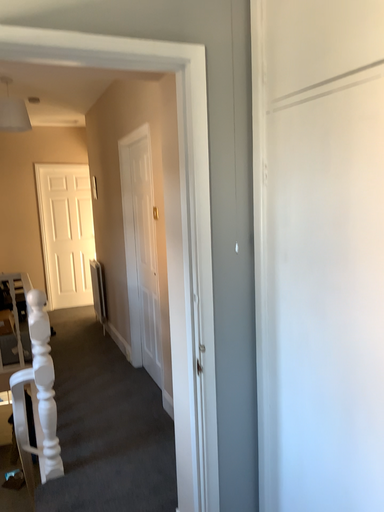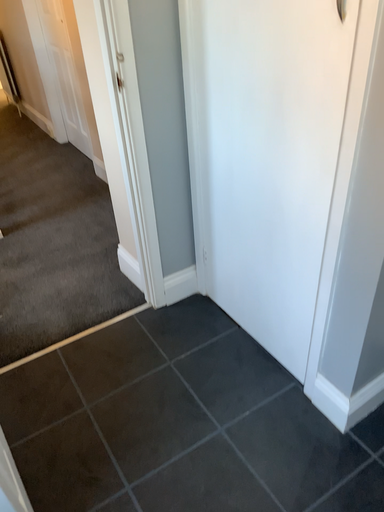
Question: Which way did the camera rotate in the video?

Choices:
 (A) rotated upward
 (B) rotated downward

Answer: (B)